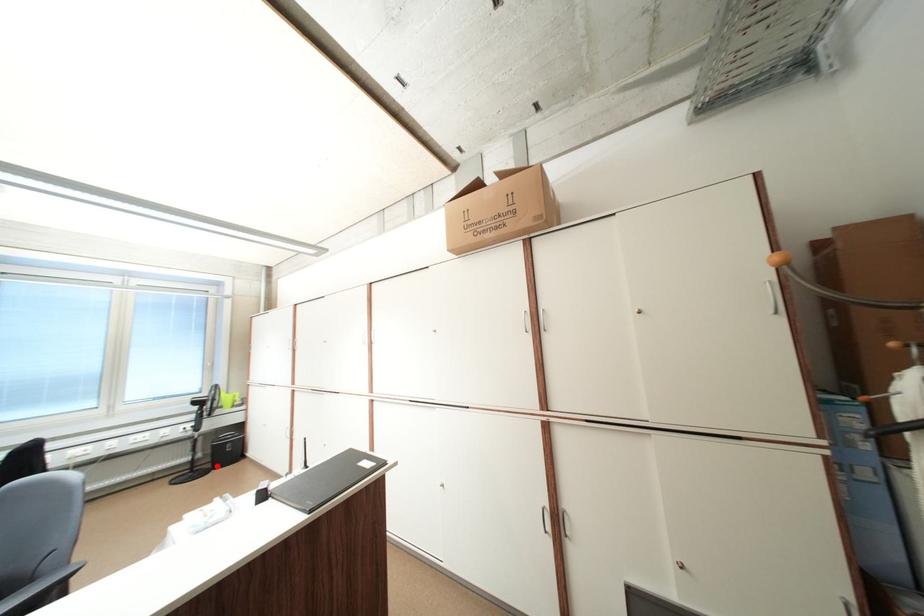
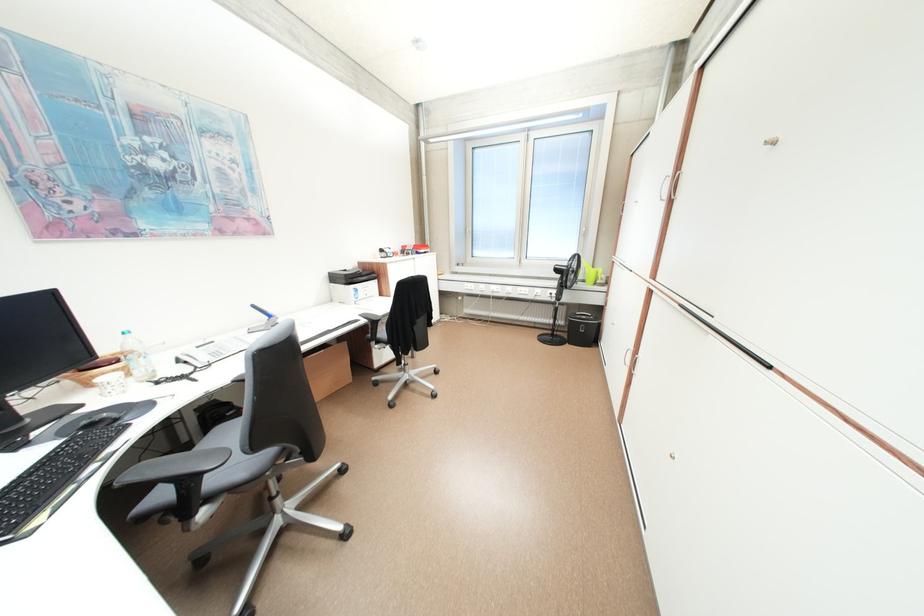
Locate, in the second image, the point that corresponds to the highlighted location in the first image.

(576, 337)